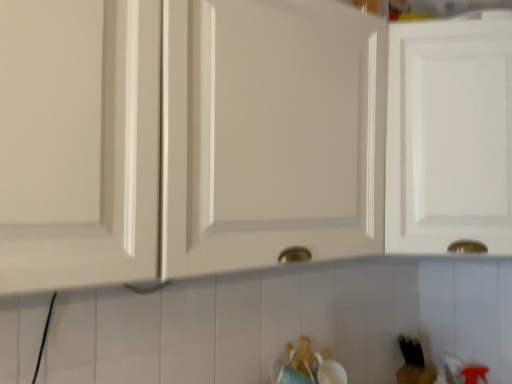
Identify the location of brown plush bear at lower center, the 2th toy when ordered from right to left. The width and height of the screenshot is (512, 384). (302, 363).

The height and width of the screenshot is (384, 512). I want to click on white glossy cabinet at center, the second cabinetry when ordered from right to left, so click(270, 132).

Where is `brown plush bear at lower center, placed as the second toy when sorted from bottom to top`? The width and height of the screenshot is (512, 384). brown plush bear at lower center, placed as the second toy when sorted from bottom to top is located at coordinates (302, 363).

Considering the relative sizes of white glossy cabinet at center, the first cabinetry positioned from the left, and white glossy cabinet door at upper right, the first cabinetry when ordered from right to left, in the image provided, is white glossy cabinet at center, the first cabinetry positioned from the left, thinner than white glossy cabinet door at upper right, the first cabinetry when ordered from right to left,?

Yes, white glossy cabinet at center, the first cabinetry positioned from the left, is thinner than white glossy cabinet door at upper right, the first cabinetry when ordered from right to left.

Considering the relative positions of white glossy cabinet at center, the first cabinetry positioned from the left, and white glossy cabinet door at upper right, the 2th cabinetry positioned from the left, in the image provided, is white glossy cabinet at center, the first cabinetry positioned from the left, in front of white glossy cabinet door at upper right, the 2th cabinetry positioned from the left,?

Yes, it is.

Does point (292, 179) come closer to viewer compared to point (408, 62)?

Yes, point (292, 179) is in front of point (408, 62).

Can you tell me how much white glossy cabinet at center, the second cabinetry when ordered from right to left, and white glossy cabinet door at upper right, the first cabinetry when ordered from right to left, differ in facing direction?

There is a 43.8-degree angle between the facing directions of white glossy cabinet at center, the second cabinetry when ordered from right to left, and white glossy cabinet door at upper right, the first cabinetry when ordered from right to left.

Is white glossy cabinet door at upper right, the first cabinetry when ordered from right to left, bigger or smaller than brown plush bear at lower center, positioned as the first toy in front-to-back order?

white glossy cabinet door at upper right, the first cabinetry when ordered from right to left, is bigger than brown plush bear at lower center, positioned as the first toy in front-to-back order.

Is white glossy cabinet door at upper right, the first cabinetry when ordered from right to left, far away from brown plush bear at lower center, the first toy from the top?

No, white glossy cabinet door at upper right, the first cabinetry when ordered from right to left, is not far from brown plush bear at lower center, the first toy from the top.

Is white glossy cabinet door at upper right, the first cabinetry when ordered from right to left, thinner than brown plush bear at lower center, placed as the second toy when sorted from bottom to top?

In fact, white glossy cabinet door at upper right, the first cabinetry when ordered from right to left, might be wider than brown plush bear at lower center, placed as the second toy when sorted from bottom to top.

Looking at this image, considering the sizes of objects white glossy cabinet door at upper right, the 2th cabinetry positioned from the left, and brown plush bear at lower center, positioned as the second toy in back-to-front order, in the image provided, who is shorter, white glossy cabinet door at upper right, the 2th cabinetry positioned from the left, or brown plush bear at lower center, positioned as the second toy in back-to-front order,?

Standing shorter between the two is brown plush bear at lower center, positioned as the second toy in back-to-front order.

Considering the relative sizes of brown plush bear at lower center, positioned as the first toy in front-to-back order, and black matte bear at lower right, the first toy in the bottom-to-top sequence, in the image provided, is brown plush bear at lower center, positioned as the first toy in front-to-back order, wider than black matte bear at lower right, the first toy in the bottom-to-top sequence,?

Correct, the width of brown plush bear at lower center, positioned as the first toy in front-to-back order, exceeds that of black matte bear at lower right, the first toy in the bottom-to-top sequence.

Is black matte bear at lower right, which appears as the 1th toy when viewed from the right, a part of brown plush bear at lower center, positioned as the second toy in back-to-front order?

No, black matte bear at lower right, which appears as the 1th toy when viewed from the right, is not a part of brown plush bear at lower center, positioned as the second toy in back-to-front order.

You are a GUI agent. You are given a task and a screenshot of the screen. Output one action in this format:
    pyautogui.click(x=<x>, y=<y>)
    Task: Click on the cabinetry on the left of the brown plush bear at lower center, positioned as the second toy in back-to-front order
    The width and height of the screenshot is (512, 384).
    Given the screenshot: What is the action you would take?
    pyautogui.click(x=270, y=132)

Considering the relative sizes of brown plush bear at lower center, positioned as the first toy in left-to-right order, and white glossy cabinet at center, the second cabinetry when ordered from right to left, in the image provided, is brown plush bear at lower center, positioned as the first toy in left-to-right order, smaller than white glossy cabinet at center, the second cabinetry when ordered from right to left,?

Yes, brown plush bear at lower center, positioned as the first toy in left-to-right order, is smaller than white glossy cabinet at center, the second cabinetry when ordered from right to left.

Is brown plush bear at lower center, the 2th toy when ordered from right to left, taller or shorter than white glossy cabinet at center, the second cabinetry when ordered from right to left?

Considering their sizes, brown plush bear at lower center, the 2th toy when ordered from right to left, has less height than white glossy cabinet at center, the second cabinetry when ordered from right to left.

From the image's perspective, would you say brown plush bear at lower center, placed as the second toy when sorted from bottom to top, is shown under white glossy cabinet at center, the second cabinetry when ordered from right to left?

Yes, from the image's perspective, brown plush bear at lower center, placed as the second toy when sorted from bottom to top, is below white glossy cabinet at center, the second cabinetry when ordered from right to left.

From the image's perspective, which object appears higher, black matte bear at lower right, the second toy positioned from the front, or white glossy cabinet door at upper right, the 2th cabinetry positioned from the left?

white glossy cabinet door at upper right, the 2th cabinetry positioned from the left, appears higher in the image.

Can you confirm if black matte bear at lower right, which is counted as the first toy, starting from the back, is bigger than white glossy cabinet door at upper right, the 2th cabinetry positioned from the left?

Incorrect, black matte bear at lower right, which is counted as the first toy, starting from the back, is not larger than white glossy cabinet door at upper right, the 2th cabinetry positioned from the left.

How different are the orientations of black matte bear at lower right, which appears as the 1th toy when viewed from the right, and white glossy cabinet door at upper right, the first cabinetry when ordered from right to left, in degrees?

40.5 degrees.

Is black matte bear at lower right, which appears as the 1th toy when viewed from the right, closer to camera compared to white glossy cabinet door at upper right, the first cabinetry when ordered from right to left?

No, black matte bear at lower right, which appears as the 1th toy when viewed from the right, is further to the viewer.

Is point (300, 379) closer to viewer compared to point (480, 39)?

No, (300, 379) is behind (480, 39).

Measure the distance between brown plush bear at lower center, positioned as the first toy in left-to-right order, and white glossy cabinet door at upper right, the first cabinetry when ordered from right to left.

brown plush bear at lower center, positioned as the first toy in left-to-right order, is 62.30 centimeters away from white glossy cabinet door at upper right, the first cabinetry when ordered from right to left.

From the image's perspective, between brown plush bear at lower center, positioned as the first toy in left-to-right order, and white glossy cabinet door at upper right, the first cabinetry when ordered from right to left, which one is located above?

From the image's view, white glossy cabinet door at upper right, the first cabinetry when ordered from right to left, is above.

From a real-world perspective, is brown plush bear at lower center, the first toy from the top, located higher than white glossy cabinet door at upper right, the first cabinetry when ordered from right to left?

Incorrect, from a real-world perspective, brown plush bear at lower center, the first toy from the top, is lower than white glossy cabinet door at upper right, the first cabinetry when ordered from right to left.

Considering the sizes of white glossy cabinet door at upper right, the first cabinetry when ordered from right to left, and white glossy cabinet at center, the second cabinetry when ordered from right to left, in the image, is white glossy cabinet door at upper right, the first cabinetry when ordered from right to left, bigger or smaller than white glossy cabinet at center, the second cabinetry when ordered from right to left,?

white glossy cabinet door at upper right, the first cabinetry when ordered from right to left, is bigger than white glossy cabinet at center, the second cabinetry when ordered from right to left.

Is the position of white glossy cabinet door at upper right, the 2th cabinetry positioned from the left, more distant than that of white glossy cabinet at center, the first cabinetry positioned from the left?

Yes, white glossy cabinet door at upper right, the 2th cabinetry positioned from the left, is behind white glossy cabinet at center, the first cabinetry positioned from the left.

Does white glossy cabinet door at upper right, the 2th cabinetry positioned from the left, turn towards white glossy cabinet at center, the second cabinetry when ordered from right to left?

No, white glossy cabinet door at upper right, the 2th cabinetry positioned from the left, is not oriented towards white glossy cabinet at center, the second cabinetry when ordered from right to left.

From a real-world perspective, is white glossy cabinet door at upper right, the first cabinetry when ordered from right to left, physically located above or below white glossy cabinet at center, the first cabinetry positioned from the left?

white glossy cabinet door at upper right, the first cabinetry when ordered from right to left, is situated higher than white glossy cabinet at center, the first cabinetry positioned from the left, in the real world.

Where is `cabinetry on the left of white glossy cabinet door at upper right, the 2th cabinetry positioned from the left`? cabinetry on the left of white glossy cabinet door at upper right, the 2th cabinetry positioned from the left is located at coordinates (270, 132).

Locate an element on the screen. the 1st toy positioned below the white glossy cabinet door at upper right, the first cabinetry when ordered from right to left (from the image's perspective) is located at coordinates (302, 363).

Looking at this image, when comparing their distances from black matte bear at lower right, which appears as the 1th toy when viewed from the right, does white glossy cabinet door at upper right, the 2th cabinetry positioned from the left, or brown plush bear at lower center, positioned as the first toy in left-to-right order, seem closer?

Based on the image, brown plush bear at lower center, positioned as the first toy in left-to-right order, appears to be nearer to black matte bear at lower right, which appears as the 1th toy when viewed from the right.

Consider the image. Looking at the image, which one is located further to white glossy cabinet door at upper right, the first cabinetry when ordered from right to left, brown plush bear at lower center, positioned as the first toy in left-to-right order, or black matte bear at lower right, positioned as the 2th toy in left-to-right order?

Based on the image, black matte bear at lower right, positioned as the 2th toy in left-to-right order, appears to be further to white glossy cabinet door at upper right, the first cabinetry when ordered from right to left.

Based on their spatial positions, is white glossy cabinet at center, the second cabinetry when ordered from right to left, or brown plush bear at lower center, the 2th toy when ordered from right to left, closer to white glossy cabinet door at upper right, the 2th cabinetry positioned from the left?

white glossy cabinet at center, the second cabinetry when ordered from right to left, lies closer to white glossy cabinet door at upper right, the 2th cabinetry positioned from the left, than the other object.

Estimate the real-world distances between objects in this image. Which object is closer to brown plush bear at lower center, the 2th toy when ordered from right to left, black matte bear at lower right, acting as the second toy starting from the top, or white glossy cabinet door at upper right, the first cabinetry when ordered from right to left?

The object closer to brown plush bear at lower center, the 2th toy when ordered from right to left, is black matte bear at lower right, acting as the second toy starting from the top.

Estimate the real-world distances between objects in this image. Which object is further from black matte bear at lower right, positioned as the 2th toy in left-to-right order, brown plush bear at lower center, placed as the second toy when sorted from bottom to top, or white glossy cabinet door at upper right, the first cabinetry when ordered from right to left?

The object further to black matte bear at lower right, positioned as the 2th toy in left-to-right order, is white glossy cabinet door at upper right, the first cabinetry when ordered from right to left.

Considering their positions, is black matte bear at lower right, acting as the second toy starting from the top, positioned closer to white glossy cabinet door at upper right, the 2th cabinetry positioned from the left, than brown plush bear at lower center, positioned as the first toy in left-to-right order?

Among the two, brown plush bear at lower center, positioned as the first toy in left-to-right order, is located nearer to white glossy cabinet door at upper right, the 2th cabinetry positioned from the left.

From the image, which object appears to be farther from white glossy cabinet at center, the first cabinetry positioned from the left, brown plush bear at lower center, positioned as the second toy in back-to-front order, or white glossy cabinet door at upper right, the 2th cabinetry positioned from the left?

brown plush bear at lower center, positioned as the second toy in back-to-front order.

Which object lies further to the anchor point black matte bear at lower right, positioned as the 2th toy in left-to-right order, brown plush bear at lower center, placed as the second toy when sorted from bottom to top, or white glossy cabinet at center, the second cabinetry when ordered from right to left?

white glossy cabinet at center, the second cabinetry when ordered from right to left.

In order to click on toy between white glossy cabinet door at upper right, the first cabinetry when ordered from right to left, and black matte bear at lower right, positioned as the 2th toy in left-to-right order, from top to bottom in this screenshot , I will do `click(302, 363)`.

The width and height of the screenshot is (512, 384). In order to click on cabinetry between white glossy cabinet at center, the second cabinetry when ordered from right to left, and black matte bear at lower right, acting as the second toy starting from the top, in the vertical direction in this screenshot , I will do `click(449, 135)`.

The image size is (512, 384). What are the coordinates of `toy between white glossy cabinet at center, the first cabinetry positioned from the left, and black matte bear at lower right, the first toy in the bottom-to-top sequence, in the front-back direction` in the screenshot? It's located at (302, 363).